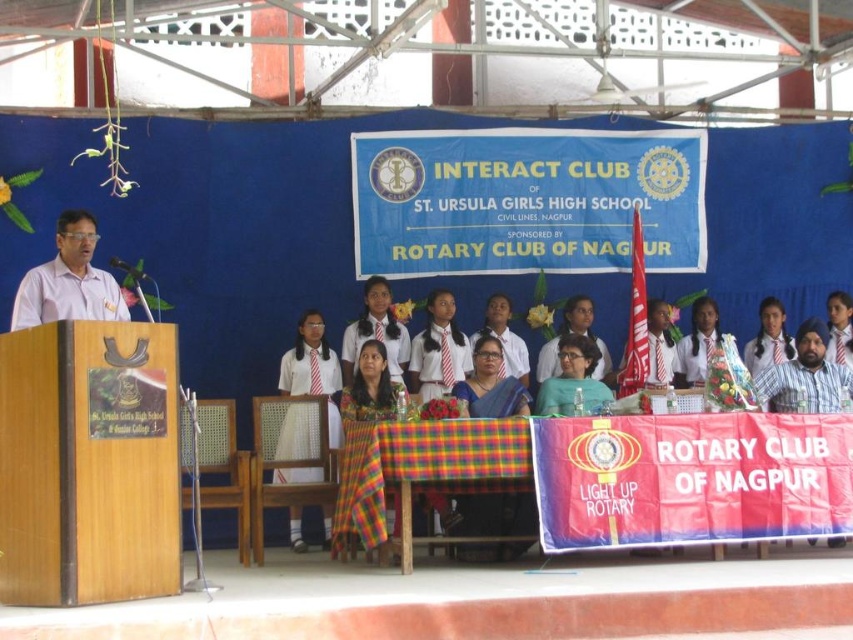
Question: Which object is positioned farthest from the matte white shirt at left?

Choices:
 (A) matte blue shirt at center
 (B) white striped shirt at center

Answer: (B)

Question: Which point appears closest to the camera in this image?

Choices:
 (A) (517, 339)
 (B) (294, 476)
 (C) (695, 320)
 (D) (585, 378)

Answer: (D)

Question: Is matte blue shirt at center above white uniform shirt at center?

Choices:
 (A) no
 (B) yes

Answer: (A)

Question: Which point is closer to the camera?

Choices:
 (A) [775, 316]
 (B) [506, 332]
 (C) [703, 300]
 (D) [107, 305]

Answer: (D)

Question: Can you confirm if white uniform shirt at center is positioned to the right of white striped shirt at center?

Choices:
 (A) yes
 (B) no

Answer: (B)

Question: Does matte white shirt at left have a larger size compared to matte black glasses at center?

Choices:
 (A) no
 (B) yes

Answer: (B)